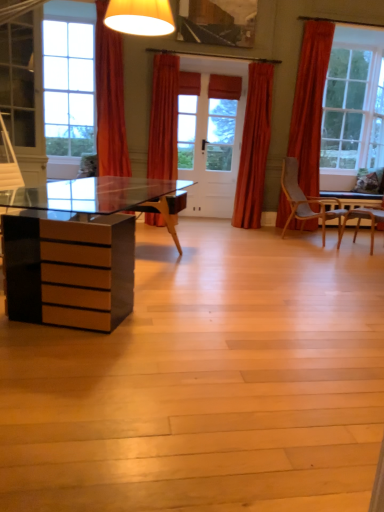
Measure the distance between point (159,57) and camera.

The depth of point (159,57) is 4.59 meters.

How much space does orange fabric curtain at upper center, which ranks as the 3th curtain in right-to-left order, occupy horizontally?

The width of orange fabric curtain at upper center, which ranks as the 3th curtain in right-to-left order, is 43.16 centimeters.

At what (x,y) coordinates should I click in order to perform the action: click on orange fabric curtain at center, which ranks as the second curtain in left-to-right order. Please return your answer as a coordinate pair (x, y). Looking at the image, I should click on (163, 119).

Considering the sizes of objects velvet orange curtain at center, which is counted as the third curtain, starting from the left, and orange fabric curtain at center, the second curtain from the right, in the image provided, who is thinner, velvet orange curtain at center, which is counted as the third curtain, starting from the left, or orange fabric curtain at center, the second curtain from the right,?

With smaller width is velvet orange curtain at center, which is counted as the third curtain, starting from the left.

Does velvet orange curtain at center, the 1th curtain when ordered from right to left, have a greater height compared to orange fabric curtain at center, the second curtain from the right?

Yes.

Is velvet orange curtain at center, which is counted as the third curtain, starting from the left, aimed at orange fabric curtain at center, which ranks as the second curtain in left-to-right order?

No.

This screenshot has height=512, width=384. What are the coordinates of `curtain located behind the orange fabric curtain at center, which ranks as the second curtain in left-to-right order` in the screenshot? It's located at (254, 147).

Could you tell me if velvet orange curtain at center, the 1th curtain when ordered from right to left, is turned towards orange fabric curtain at upper center, which ranks as the 3th curtain in right-to-left order?

No, velvet orange curtain at center, the 1th curtain when ordered from right to left, is not facing towards orange fabric curtain at upper center, which ranks as the 3th curtain in right-to-left order.

Locate an element on the screen. This screenshot has width=384, height=512. the 2nd curtain below the orange fabric curtain at upper center, which ranks as the 3th curtain in right-to-left order (from the image's perspective) is located at coordinates (254, 147).

From a real-world perspective, is velvet orange curtain at center, the 1th curtain when ordered from right to left, above or below orange fabric curtain at upper center, the 1th curtain in the left-to-right sequence?

Clearly, from a real-world perspective, velvet orange curtain at center, the 1th curtain when ordered from right to left, is below orange fabric curtain at upper center, the 1th curtain in the left-to-right sequence.

Looking at this image, which of these two, velvet orange curtain at center, the 1th curtain when ordered from right to left, or orange fabric curtain at upper center, which ranks as the 3th curtain in right-to-left order, is smaller?

With smaller size is velvet orange curtain at center, the 1th curtain when ordered from right to left.

In the image, is orange fabric curtain at upper center, which ranks as the 3th curtain in right-to-left order, on the left side or the right side of orange fabric curtain at center, which ranks as the second curtain in left-to-right order?

Based on their positions, orange fabric curtain at upper center, which ranks as the 3th curtain in right-to-left order, is located to the left of orange fabric curtain at center, which ranks as the second curtain in left-to-right order.

What are the coordinates of `the 1st curtain behind the orange fabric curtain at upper center, the 1th curtain in the left-to-right sequence, starting your count from the anchor` in the screenshot? It's located at (163, 119).

Is orange fabric curtain at upper center, the 1th curtain in the left-to-right sequence, facing towards orange fabric curtain at center, which ranks as the second curtain in left-to-right order?

No, orange fabric curtain at upper center, the 1th curtain in the left-to-right sequence, is not aimed at orange fabric curtain at center, which ranks as the second curtain in left-to-right order.

Is orange fabric curtain at upper center, the 1th curtain in the left-to-right sequence, beside velvet orange curtain at center, which is counted as the third curtain, starting from the left?

No, orange fabric curtain at upper center, the 1th curtain in the left-to-right sequence, is not beside velvet orange curtain at center, which is counted as the third curtain, starting from the left.

From a real-world perspective, relative to velvet orange curtain at center, the 1th curtain when ordered from right to left, is orange fabric curtain at upper center, the 1th curtain in the left-to-right sequence, vertically above or below?

In terms of real-world spatial position, orange fabric curtain at upper center, the 1th curtain in the left-to-right sequence, is above velvet orange curtain at center, the 1th curtain when ordered from right to left.

Can you tell me how much orange fabric curtain at upper center, which ranks as the 3th curtain in right-to-left order, and velvet orange curtain at center, the 1th curtain when ordered from right to left, differ in facing direction?

orange fabric curtain at upper center, which ranks as the 3th curtain in right-to-left order, and velvet orange curtain at center, the 1th curtain when ordered from right to left, are facing 0.419 degrees away from each other.

Is velvet orange curtain at center, which is counted as the third curtain, starting from the left, at the back of orange fabric curtain at upper center, which ranks as the 3th curtain in right-to-left order?

That's not correct — orange fabric curtain at upper center, which ranks as the 3th curtain in right-to-left order, is not looking away from velvet orange curtain at center, which is counted as the third curtain, starting from the left.

Can you confirm if orange fabric curtain at center, which ranks as the second curtain in left-to-right order, is taller than orange fabric curtain at upper center, which ranks as the 3th curtain in right-to-left order?

No, orange fabric curtain at center, which ranks as the second curtain in left-to-right order, is not taller than orange fabric curtain at upper center, which ranks as the 3th curtain in right-to-left order.

Do you think orange fabric curtain at center, which ranks as the second curtain in left-to-right order, is within orange fabric curtain at upper center, which ranks as the 3th curtain in right-to-left order, or outside of it?

orange fabric curtain at center, which ranks as the second curtain in left-to-right order, is not inside orange fabric curtain at upper center, which ranks as the 3th curtain in right-to-left order, it's outside.

This screenshot has height=512, width=384. I want to click on the 1st curtain behind the orange fabric curtain at upper center, which ranks as the 3th curtain in right-to-left order, starting your count from the anchor, so click(x=163, y=119).

Which is in front, point (169, 154) or point (101, 39)?

The point (101, 39) is closer to the camera.

From the image's perspective, is orange fabric curtain at center, the second curtain from the right, located beneath velvet orange curtain at center, which is counted as the third curtain, starting from the left?

No, from the image's perspective, orange fabric curtain at center, the second curtain from the right, is not below velvet orange curtain at center, which is counted as the third curtain, starting from the left.

Is velvet orange curtain at center, the 1th curtain when ordered from right to left, at the back of orange fabric curtain at center, which ranks as the second curtain in left-to-right order?

orange fabric curtain at center, which ranks as the second curtain in left-to-right order, does not have its back to velvet orange curtain at center, the 1th curtain when ordered from right to left.

Can you tell me how much orange fabric curtain at center, which ranks as the second curtain in left-to-right order, and velvet orange curtain at center, which is counted as the third curtain, starting from the left, differ in facing direction?

1.61 degrees.

Which of these two, orange fabric curtain at center, the second curtain from the right, or velvet orange curtain at center, which is counted as the third curtain, starting from the left, stands taller?

Standing taller between the two is velvet orange curtain at center, which is counted as the third curtain, starting from the left.

The height and width of the screenshot is (512, 384). I want to click on curtain that is on the right side of orange fabric curtain at center, which ranks as the second curtain in left-to-right order, so click(x=254, y=147).

From a real-world perspective, which curtain is the 2nd one underneath the orange fabric curtain at upper center, which ranks as the 3th curtain in right-to-left order? Please provide its 2D coordinates.

[(254, 147)]

Which object lies further to the anchor point orange fabric curtain at upper center, which ranks as the 3th curtain in right-to-left order, velvet orange curtain at center, the 1th curtain when ordered from right to left, or orange fabric curtain at center, which ranks as the second curtain in left-to-right order?

Based on the image, velvet orange curtain at center, the 1th curtain when ordered from right to left, appears to be further to orange fabric curtain at upper center, which ranks as the 3th curtain in right-to-left order.

Based on their spatial positions, is orange fabric curtain at center, which ranks as the second curtain in left-to-right order, or orange fabric curtain at upper center, the 1th curtain in the left-to-right sequence, closer to velvet orange curtain at center, the 1th curtain when ordered from right to left?

orange fabric curtain at center, which ranks as the second curtain in left-to-right order, lies closer to velvet orange curtain at center, the 1th curtain when ordered from right to left, than the other object.

From the image, which object appears to be farther from orange fabric curtain at center, the second curtain from the right, velvet orange curtain at center, which is counted as the third curtain, starting from the left, or orange fabric curtain at upper center, the 1th curtain in the left-to-right sequence?

velvet orange curtain at center, which is counted as the third curtain, starting from the left.

Based on their spatial positions, is orange fabric curtain at upper center, which ranks as the 3th curtain in right-to-left order, or orange fabric curtain at center, the second curtain from the right, closer to velvet orange curtain at center, which is counted as the third curtain, starting from the left?

orange fabric curtain at center, the second curtain from the right.

Looking at the image, which one is located further to orange fabric curtain at upper center, the 1th curtain in the left-to-right sequence, orange fabric curtain at center, the second curtain from the right, or velvet orange curtain at center, the 1th curtain when ordered from right to left?

Based on the image, velvet orange curtain at center, the 1th curtain when ordered from right to left, appears to be further to orange fabric curtain at upper center, the 1th curtain in the left-to-right sequence.

Which object lies further to the anchor point orange fabric curtain at center, which ranks as the second curtain in left-to-right order, orange fabric curtain at upper center, which ranks as the 3th curtain in right-to-left order, or velvet orange curtain at center, the 1th curtain when ordered from right to left?

Based on the image, velvet orange curtain at center, the 1th curtain when ordered from right to left, appears to be further to orange fabric curtain at center, which ranks as the second curtain in left-to-right order.

This screenshot has height=512, width=384. Identify the location of curtain located between orange fabric curtain at upper center, which ranks as the 3th curtain in right-to-left order, and velvet orange curtain at center, which is counted as the third curtain, starting from the left, in the left-right direction. (163, 119).